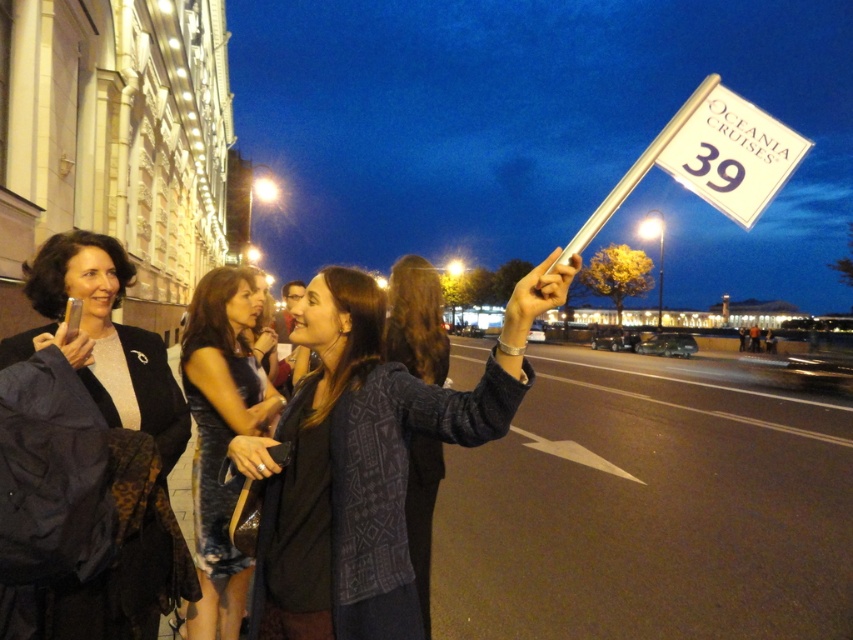
Is matte black jacket at left shorter than knitted sweater at center?

Correct, matte black jacket at left is not as tall as knitted sweater at center.

Which is in front, point (166, 449) or point (440, 353)?

Point (166, 449) is more forward.

Locate an element on the screen. The width and height of the screenshot is (853, 640). matte black jacket at left is located at coordinates (105, 337).

Does dark blue textured sweater at center appear over shiny metallic dress at center?

Yes.

Between dark blue textured sweater at center and shiny metallic dress at center, which one has less height?

dark blue textured sweater at center is shorter.

Between point (345, 454) and point (233, 634), which one is positioned behind?

Positioned behind is point (233, 634).

I want to click on dark blue textured sweater at center, so click(x=366, y=460).

Is white paper flag at upper right above knitted sweater at center?

Indeed, white paper flag at upper right is positioned over knitted sweater at center.

The height and width of the screenshot is (640, 853). I want to click on white paper flag at upper right, so click(x=729, y=150).

Identify the location of white paper flag at upper right. The width and height of the screenshot is (853, 640). (729, 150).